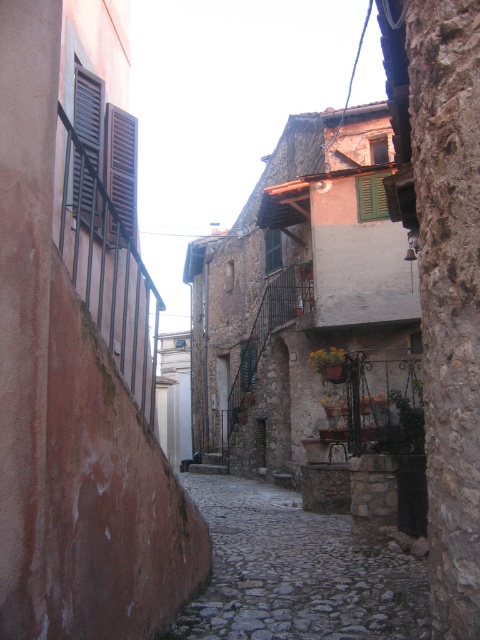
Question: Is matte black shutters at left thinner than green matte shutter at upper center?

Choices:
 (A) no
 (B) yes

Answer: (B)

Question: Can you confirm if cobblestone path at center is positioned to the right of matte black shutters at left?

Choices:
 (A) no
 (B) yes

Answer: (B)

Question: Which point is closer to the camera?

Choices:
 (A) click(x=91, y=86)
 (B) click(x=133, y=122)
 (C) click(x=212, y=477)
 (D) click(x=360, y=177)

Answer: (A)

Question: Which of the following is the closest to the observer?

Choices:
 (A) matte black shutters at left
 (B) matte black shutters at upper left
 (C) cobblestone path at center
 (D) green matte shutter at upper center

Answer: (C)

Question: Estimate the real-world distances between objects in this image. Which object is closer to the green matte shutter at upper center?

Choices:
 (A) matte black shutters at upper left
 (B) matte black shutters at left

Answer: (B)

Question: From the image, what is the correct spatial relationship of cobblestone path at center in relation to matte black shutters at left?

Choices:
 (A) below
 (B) above

Answer: (A)